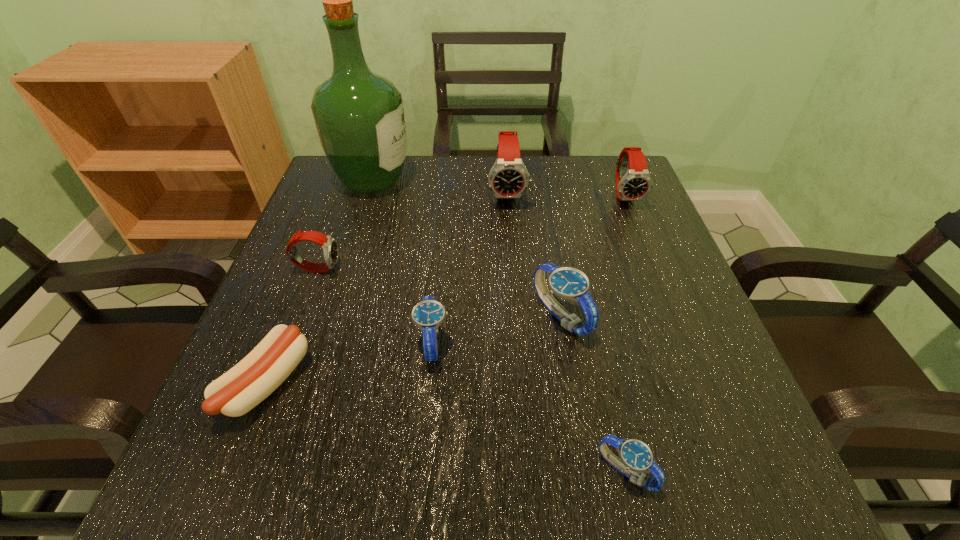
Where is `free space between the nearest watch and the green liquor`? This screenshot has height=540, width=960. free space between the nearest watch and the green liquor is located at coordinates (499, 325).

This screenshot has width=960, height=540. Identify the location of vacant area that lies between the sausage and the leftmost blue watch. (349, 362).

Find the location of `empty space that is in between the liquor and the nearest blue watch`. empty space that is in between the liquor and the nearest blue watch is located at coordinates (499, 325).

The image size is (960, 540). In order to click on free space between the leftmost blue watch and the second tallest object in this screenshot , I will do pos(470,267).

The width and height of the screenshot is (960, 540). In order to click on the second closest object to the tallest watch in this screenshot , I will do `click(633, 182)`.

Locate which object ranks in proximity to the second red watch from left to right. Please provide its 2D coordinates. Your answer should be formatted as a tuple, i.e. [(x, y)], where the tuple contains the x and y coordinates of a point satisfying the conditions above.

[(359, 116)]

Identify which watch is the nearest to the fourth farthest object. Please provide its 2D coordinates. Your answer should be formatted as a tuple, i.e. [(x, y)], where the tuple contains the x and y coordinates of a point satisfying the conditions above.

[(428, 314)]

Locate which watch is the fourth closest to the biggest blue watch. Please provide its 2D coordinates. Your answer should be formatted as a tuple, i.e. [(x, y)], where the tuple contains the x and y coordinates of a point satisfying the conditions above.

[(633, 182)]

Select which red watch appears as the second closest to the smallest blue watch. Please provide its 2D coordinates. Your answer should be formatted as a tuple, i.e. [(x, y)], where the tuple contains the x and y coordinates of a point satisfying the conditions above.

[(508, 178)]

Where is `the third closest red watch to the biggest blue watch`? The height and width of the screenshot is (540, 960). the third closest red watch to the biggest blue watch is located at coordinates (330, 248).